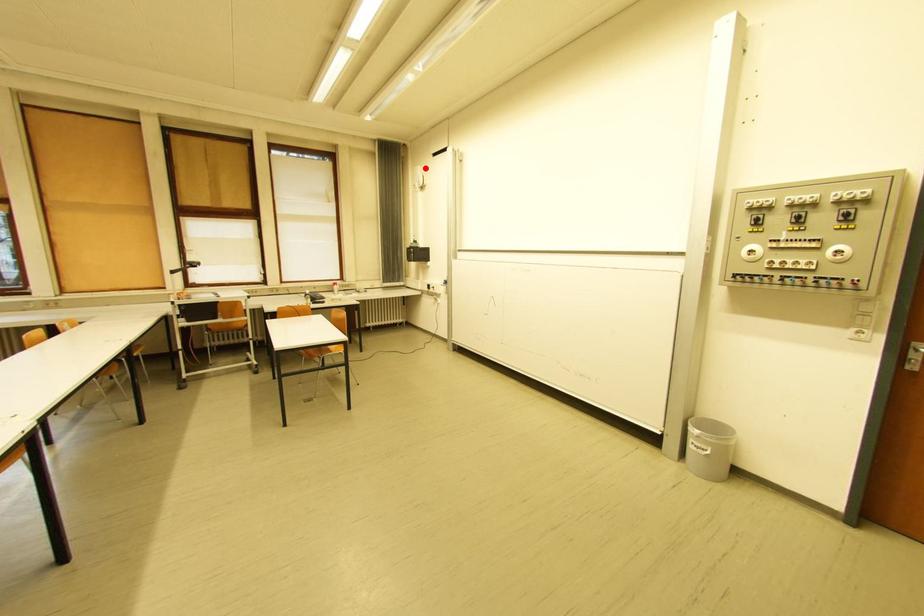
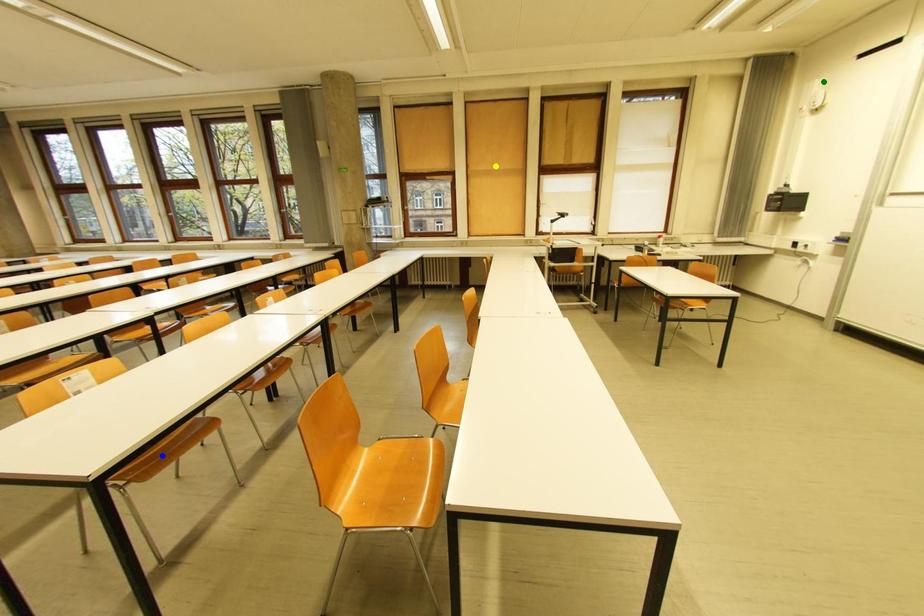
Question: I am providing you with two images of the same scene from different viewpoints. A red point is marked on the first image. You are given multiple points on the second image. Which mark in image 2 goes with the point in image 1?

Choices:
 (A) blue point
 (B) yellow point
 (C) green point

Answer: (C)